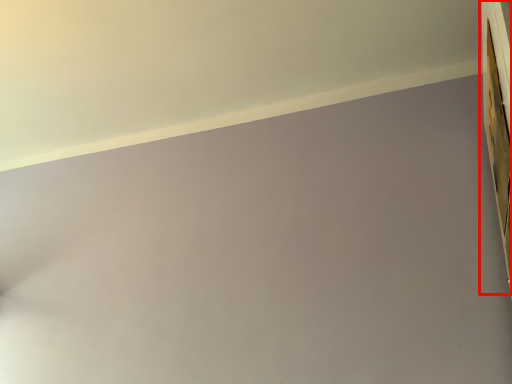
Question: From the image's perspective, what is the correct spatial positioning of window frame (annotated by the red box) in reference to window sill?

Choices:
 (A) above
 (B) below

Answer: (B)